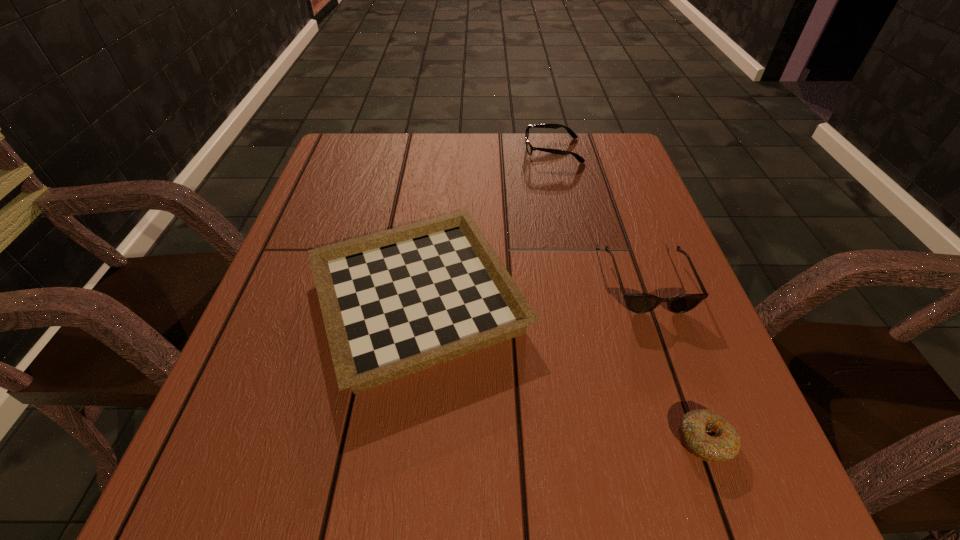
The width and height of the screenshot is (960, 540). Identify the location of vacant region located on the back of the doughnut. (656, 306).

Find the location of a particular element. object that is at the far edge is located at coordinates (529, 147).

I want to click on object located at the near edge, so click(x=707, y=435).

This screenshot has height=540, width=960. Identify the location of object at the left edge. (395, 302).

At what (x,y) coordinates should I click in order to perform the action: click on sunglasses that is at the right edge. Please return your answer as a coordinate pair (x, y). Looking at the image, I should click on (638, 303).

Where is `spectacles located in the right edge section of the desktop`? spectacles located in the right edge section of the desktop is located at coordinates (529, 147).

Image resolution: width=960 pixels, height=540 pixels. I want to click on doughnut that is at the right edge, so click(x=707, y=435).

The image size is (960, 540). Identify the location of object at the far right corner. (529, 147).

The width and height of the screenshot is (960, 540). In order to click on object situated at the near right corner in this screenshot , I will do pyautogui.click(x=707, y=435).

Where is `free space at the far edge`? free space at the far edge is located at coordinates (455, 161).